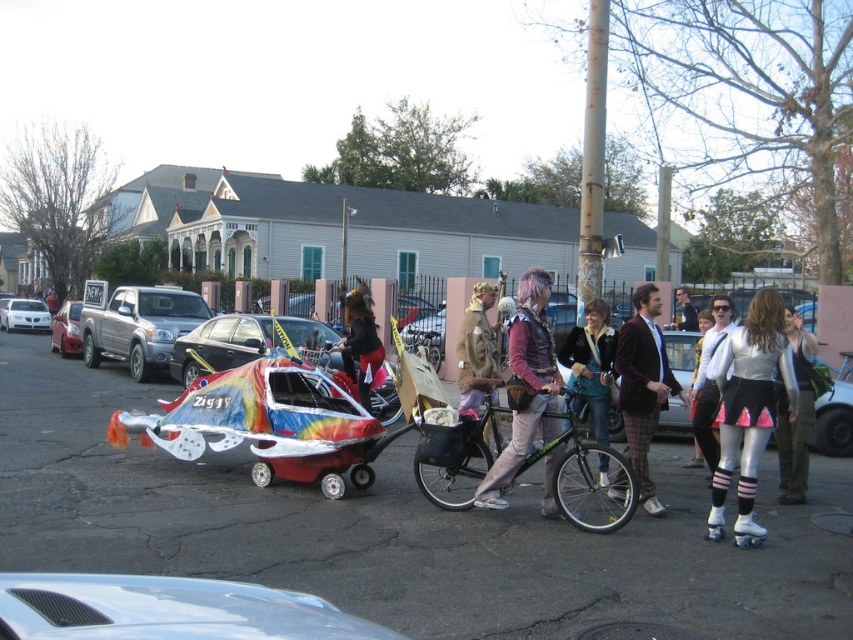
You are standing at the point labeled point (523, 291) and want to walk to the point labeled point (73, 316). Which direction should you move to get closer to your destination?

You should move downward because point (73, 316) is further away from the camera compared to point (523, 291), so moving downward would take you towards it.

You are a photographer standing at the edge of the street. You want to take a photo of the metallic silver car at center. Where should you position yourself to capture it in the best possible frame?

To capture the metallic silver car at center, position yourself at the edge of the street directly in front of it, aligning your camera with its central position at coordinates approximately 0.830 on the horizontal axis and 0.464 on the vertical axis.